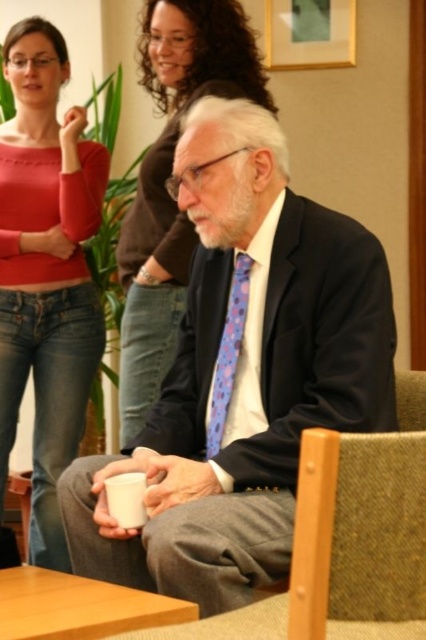
You are a photographer standing at the camera position. You want to place a small vase on the light brown wood table at lower left. The vase is 1 foot tall. Can you estimate if the table is tall enough to place the vase?

The light brown wood table at lower left is 4.07 feet from camera. Since the table height is not provided, we cannot determine if it is tall enough for the vase.

Based on the photo, you are standing in the room and want to place a small vase on the light brown wood table at lower left. Based on the coordinates provided, can you confirm if the point marked as point (78,605) is indeed the location of the table?

Yes, the light brown wood table at lower left is represented by point (78,605), so placing the vase there would be correct.